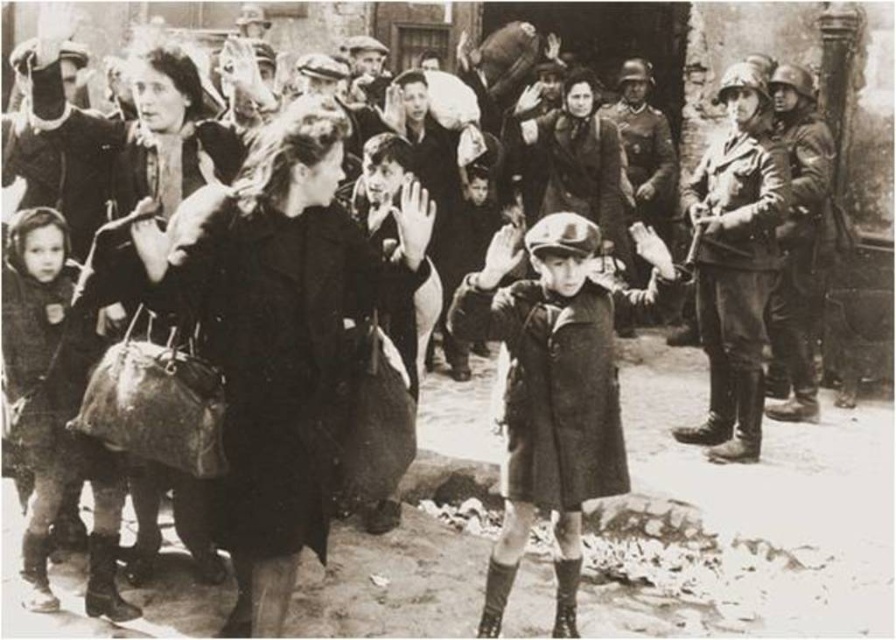
You are a photographer standing at the camera position. You want to capture a closeup shot of the dark wool coat at center. Considering the distance, is it possible to do so without moving closer?

The dark wool coat at center is 22.78 feet away from the camera. Since this distance is relatively far, capturing a closeup shot without moving closer would be challenging and likely require a telephoto lens to achieve the desired framing.

You are a tailor observing the scene and need to determine which coat requires more fabric to make between the dark wool coat at center and the dark gray fabric coat at left. Based on the description, which coat would need more material?

The dark wool coat at center is bigger than the dark gray fabric coat at left, so it would require more fabric to make.